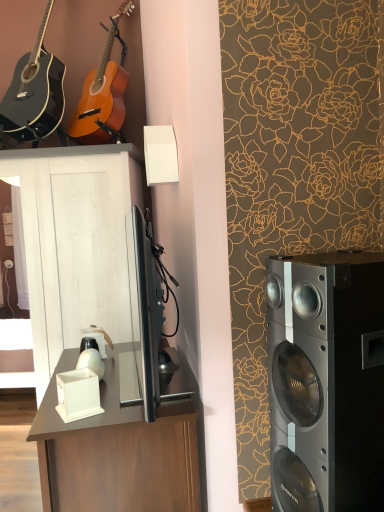
Question: Could you tell me if white wood cabinet at center is facing silver metallic speaker at right?

Choices:
 (A) yes
 (B) no

Answer: (B)

Question: From a real-world perspective, is white wood cabinet at center positioned under silver metallic speaker at right based on gravity?

Choices:
 (A) yes
 (B) no

Answer: (A)

Question: Is white wood cabinet at center far from silver metallic speaker at right?

Choices:
 (A) no
 (B) yes

Answer: (B)

Question: From the image's perspective, does white wood cabinet at center appear lower than silver metallic speaker at right?

Choices:
 (A) yes
 (B) no

Answer: (A)

Question: Is white wood cabinet at center at the left side of silver metallic speaker at right?

Choices:
 (A) yes
 (B) no

Answer: (A)

Question: Considering the relative positions of matte black acoustic guitar at upper left, marked as the 2th guitar in a right-to-left arrangement, and white wood cabinet at center in the image provided, is matte black acoustic guitar at upper left, marked as the 2th guitar in a right-to-left arrangement, to the left or to the right of white wood cabinet at center?

Choices:
 (A) left
 (B) right

Answer: (A)

Question: From the image's perspective, relative to white wood cabinet at center, is matte black acoustic guitar at upper left, which is the first guitar in left-to-right order, above or below?

Choices:
 (A) below
 (B) above

Answer: (B)

Question: Is matte black acoustic guitar at upper left, marked as the 2th guitar in a right-to-left arrangement, bigger or smaller than white wood cabinet at center?

Choices:
 (A) big
 (B) small

Answer: (B)

Question: Is point (49, 70) positioned closer to the camera than point (114, 224)?

Choices:
 (A) closer
 (B) farther

Answer: (B)

Question: From a real-world perspective, is matte brown desk at center positioned above or below white wood cabinet at center?

Choices:
 (A) above
 (B) below

Answer: (B)

Question: Does point (147, 487) appear closer or farther from the camera than point (51, 359)?

Choices:
 (A) closer
 (B) farther

Answer: (A)

Question: Would you say matte brown desk at center is inside or outside white wood cabinet at center?

Choices:
 (A) outside
 (B) inside

Answer: (A)

Question: In terms of height, does matte brown desk at center look taller or shorter compared to white wood cabinet at center?

Choices:
 (A) tall
 (B) short

Answer: (B)

Question: Based on their positions, is white wood cabinet at center located to the left or right of matte black acoustic guitar at upper left, which is the first guitar in left-to-right order?

Choices:
 (A) right
 (B) left

Answer: (A)

Question: Relative to matte black acoustic guitar at upper left, which is the first guitar in left-to-right order, is white wood cabinet at center in front or behind?

Choices:
 (A) front
 (B) behind

Answer: (B)